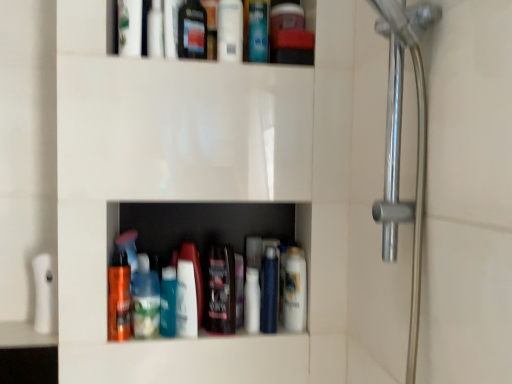
Question: Can you confirm if shiny orange bottle at lower center, which ranks as the 8th mouthwash in right-to-left order, is shorter than white glossy lotion at center, acting as the second toiletry starting from the left?

Choices:
 (A) yes
 (B) no

Answer: (B)

Question: Is shiny orange bottle at lower center, which is counted as the 1th mouthwash, starting from the left, smaller than white glossy lotion at center, acting as the second toiletry starting from the left?

Choices:
 (A) yes
 (B) no

Answer: (A)

Question: Is shiny orange bottle at lower center, which is counted as the 1th mouthwash, starting from the left, not inside white glossy lotion at center, which appears as the 1th toiletry when ordered from the bottom?

Choices:
 (A) no
 (B) yes

Answer: (B)

Question: Is shiny orange bottle at lower center, which is counted as the 1th mouthwash, starting from the left, bigger than white glossy lotion at center, acting as the second toiletry starting from the left?

Choices:
 (A) no
 (B) yes

Answer: (A)

Question: Is shiny orange bottle at lower center, which is counted as the 1th mouthwash, starting from the left, to the left of white glossy lotion at center, acting as the second toiletry starting from the left, from the viewer's perspective?

Choices:
 (A) yes
 (B) no

Answer: (A)

Question: Is transparent plastic bottle at upper center, arranged as the 1th toiletry when viewed from the top, in front of or behind translucent plastic bottles at center in the image?

Choices:
 (A) behind
 (B) front

Answer: (B)

Question: Is transparent plastic bottle at upper center, the 2th toiletry ordered from the bottom, situated inside translucent plastic bottles at center or outside?

Choices:
 (A) outside
 (B) inside

Answer: (A)

Question: Considering the positions of transparent plastic bottle at upper center, the 2th toiletry ordered from the bottom, and translucent plastic bottles at center in the image, is transparent plastic bottle at upper center, the 2th toiletry ordered from the bottom, wider or thinner than translucent plastic bottles at center?

Choices:
 (A) wide
 (B) thin

Answer: (A)

Question: Looking at the image, does transparent plastic bottle at upper center, arranged as the 1th toiletry when viewed from the top, seem bigger or smaller compared to translucent plastic bottles at center?

Choices:
 (A) small
 (B) big

Answer: (A)

Question: From the image's perspective, is shiny black bottle at center, placed as the fifth mouthwash when sorted from right to left, above or below translucent plastic bottle at center?

Choices:
 (A) below
 (B) above

Answer: (B)

Question: In the image, is shiny black bottle at center, which ranks as the 4th mouthwash in left-to-right order, positioned in front of or behind translucent plastic bottle at center?

Choices:
 (A) behind
 (B) front

Answer: (A)

Question: Considering the relative positions of shiny black bottle at center, which ranks as the 4th mouthwash in left-to-right order, and translucent plastic bottle at center in the image provided, is shiny black bottle at center, which ranks as the 4th mouthwash in left-to-right order, to the left or to the right of translucent plastic bottle at center?

Choices:
 (A) right
 (B) left

Answer: (A)

Question: Considering the positions of point (205, 296) and point (175, 326), is point (205, 296) closer or farther from the camera than point (175, 326)?

Choices:
 (A) farther
 (B) closer

Answer: (A)

Question: Considering the positions of transparent plastic bottle at upper center, the first toiletry when ordered from left to right, and silver metallic shower handle at right in the image, is transparent plastic bottle at upper center, the first toiletry when ordered from left to right, taller or shorter than silver metallic shower handle at right?

Choices:
 (A) tall
 (B) short

Answer: (B)

Question: Does point (155, 46) appear closer or farther from the camera than point (394, 246)?

Choices:
 (A) closer
 (B) farther

Answer: (B)